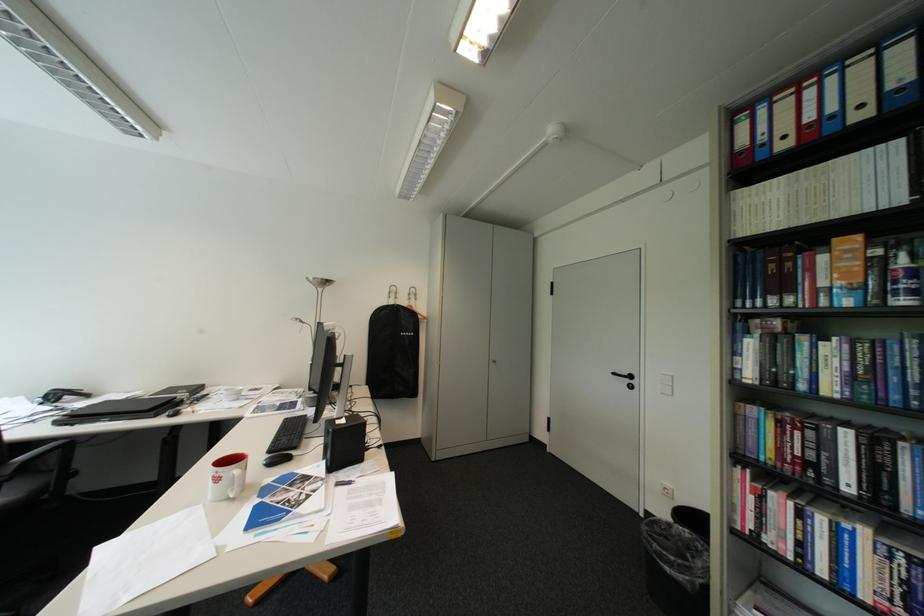
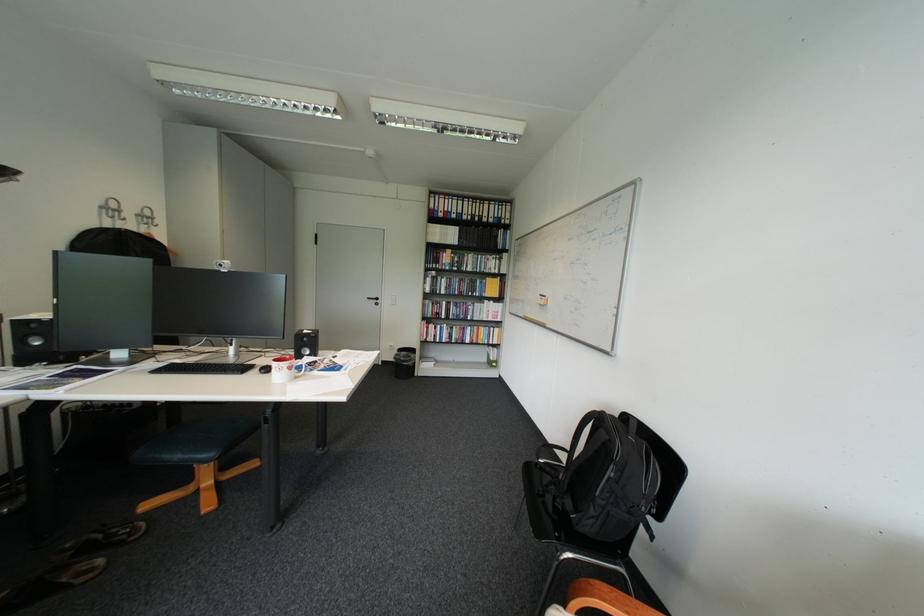
Find the pixel in the second image that matches point (408, 299) in the first image.

(137, 220)